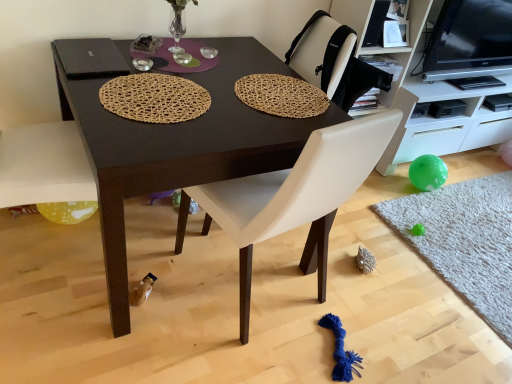
You are a GUI agent. You are given a task and a screenshot of the screen. Output one action in this format:
    pyautogui.click(x=<x>, y=<y>)
    Task: Click on the free location to the right of dark brown wood table at center
    This screenshot has height=384, width=512.
    Given the screenshot: What is the action you would take?
    pyautogui.click(x=380, y=280)